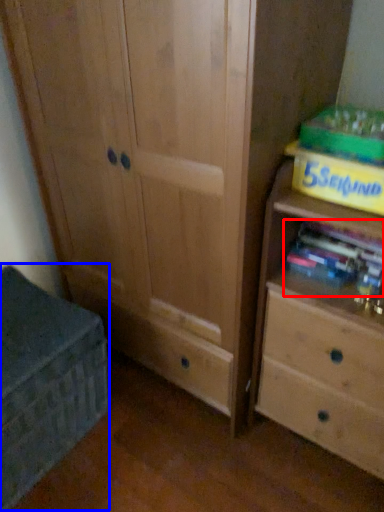
Question: Which object is closer to the camera taking this photo, book (highlighted by a red box) or cabinetry (highlighted by a blue box)?

Choices:
 (A) book
 (B) cabinetry

Answer: (B)